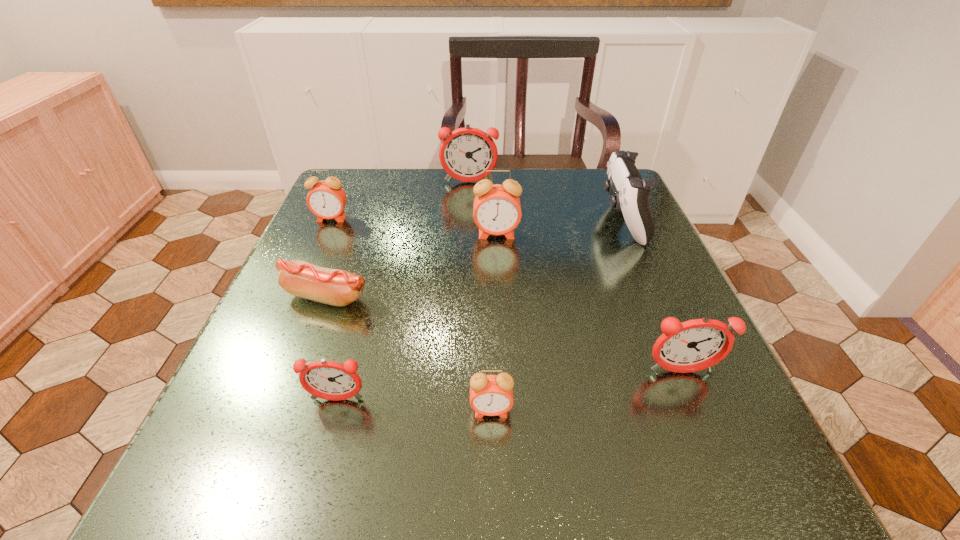
I want to click on vacant area situated on the front-facing side of the rightmost reddish-pink alarm clock, so click(x=716, y=455).

Identify the location of free location located 0.130m on the front-facing side of the leftmost reddish-pink alarm clock. This screenshot has width=960, height=540. (309, 499).

Where is `vacant region located 0.110m on the face of the smallest pink alarm clock`? The image size is (960, 540). vacant region located 0.110m on the face of the smallest pink alarm clock is located at coordinates (493, 501).

Locate an element on the screen. This screenshot has height=540, width=960. blank area located on the right of the brown sausage is located at coordinates (482, 296).

You are a GUI agent. You are given a task and a screenshot of the screen. Output one action in this format:
    pyautogui.click(x=<x>, y=<y>)
    Task: Click on the control that is at the far edge
    The width and height of the screenshot is (960, 540).
    Given the screenshot: What is the action you would take?
    pyautogui.click(x=631, y=192)

Locate an element on the screen. The height and width of the screenshot is (540, 960). sausage at the left edge is located at coordinates (299, 278).

Where is `control situated at the right edge`? control situated at the right edge is located at coordinates (631, 192).

Where is `alarm clock that is at the right edge`? The width and height of the screenshot is (960, 540). alarm clock that is at the right edge is located at coordinates (694, 345).

Image resolution: width=960 pixels, height=540 pixels. I want to click on object situated at the far left corner, so click(x=326, y=199).

Identify the location of object present at the far right corner. (631, 192).